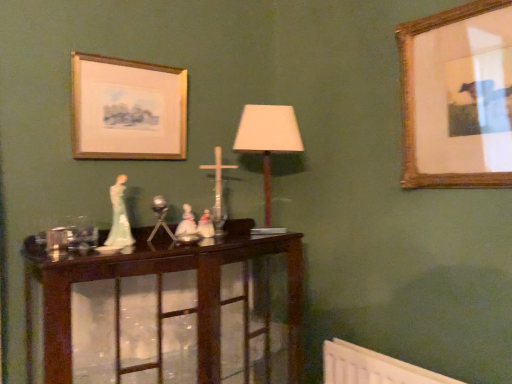
Question: Is dark wood table at center inside or outside of matte white shade at center?

Choices:
 (A) outside
 (B) inside

Answer: (A)

Question: In terms of size, does dark wood table at center appear bigger or smaller than matte white shade at center?

Choices:
 (A) big
 (B) small

Answer: (A)

Question: Which object is the farthest from the white porcelain figurines at center?

Choices:
 (A) wooden picture frame at upper right, arranged as the 2th picture frame when viewed from the left
 (B) matte white shade at center
 (C) wooden picture frame at upper left, arranged as the 1th picture frame when viewed from the left
 (D) dark wood table at center

Answer: (A)

Question: Which of these objects is positioned closest to the wooden picture frame at upper right, which is the 1th picture frame in right-to-left order?

Choices:
 (A) white porcelain figurines at center
 (B) wooden picture frame at upper left, arranged as the 1th picture frame when viewed from the left
 (C) dark wood table at center
 (D) matte white shade at center

Answer: (D)